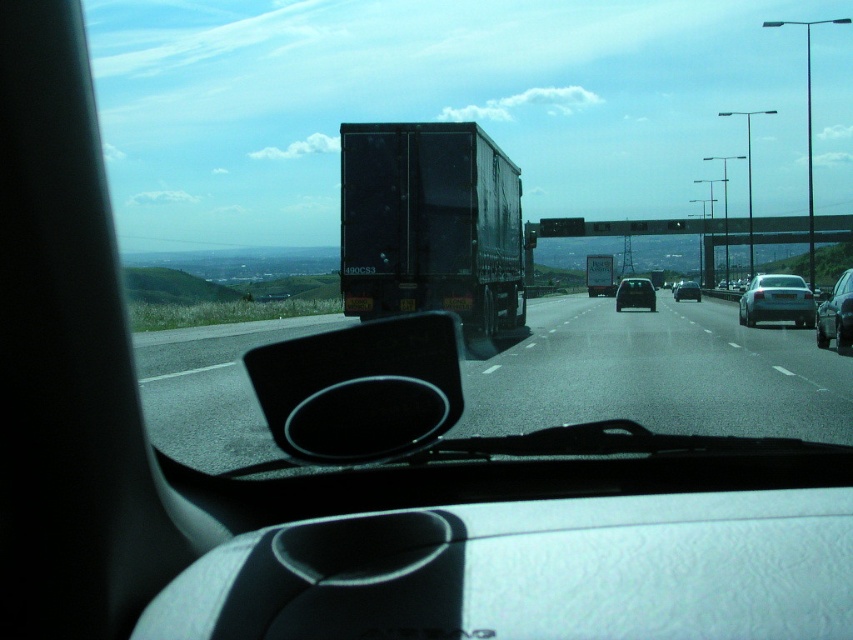
Does black rubber road at center have a greater height compared to black matte trailer truck at center?

No.

Is point (677, 406) positioned before point (451, 284)?

Yes, it is in front of point (451, 284).

Describe the element at coordinates (659, 372) in the screenshot. I see `black rubber road at center` at that location.

Where is `black rubber road at center`? This screenshot has height=640, width=853. black rubber road at center is located at coordinates (659, 372).

Can you confirm if black matte view mirror at center is positioned below matte black car at center?

Correct, black matte view mirror at center is located below matte black car at center.

Which is in front, point (291, 438) or point (616, 296)?

Positioned in front is point (291, 438).

Describe the element at coordinates (360, 388) in the screenshot. I see `black matte view mirror at center` at that location.

You are a GUI agent. You are given a task and a screenshot of the screen. Output one action in this format:
    pyautogui.click(x=<x>, y=<y>)
    Task: Click on the black matte view mirror at center
    
    Given the screenshot: What is the action you would take?
    pyautogui.click(x=360, y=388)

Consider the image. Is black matte view mirror at center below shiny silver sedan at center?

Correct, black matte view mirror at center is located below shiny silver sedan at center.

The height and width of the screenshot is (640, 853). I want to click on black matte view mirror at center, so click(360, 388).